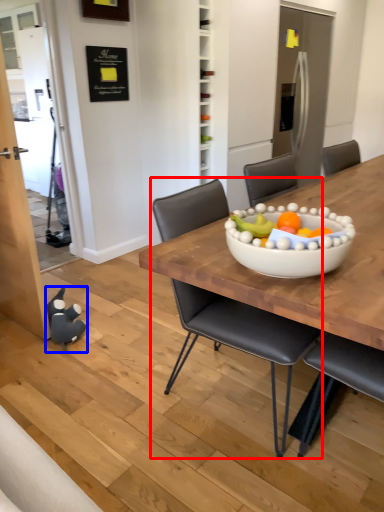
Question: Among these objects, which one is farthest to the camera, chair (highlighted by a red box) or toy (highlighted by a blue box)?

Choices:
 (A) chair
 (B) toy

Answer: (B)